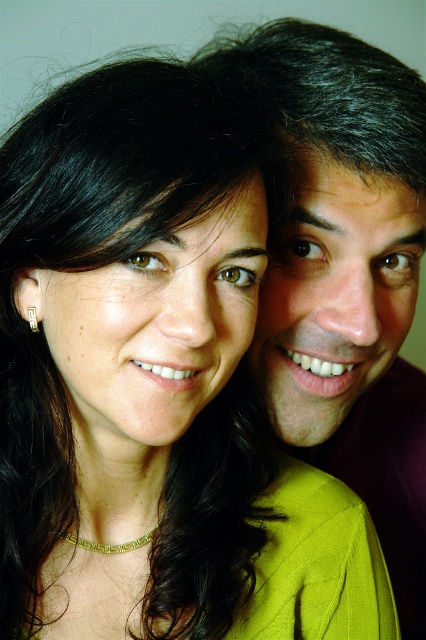
You are a photographer trying to capture a closeup of the gold textured necklace at lower center and the gold textured square at left. Which object should you focus on first if you want to ensure both are in focus without moving the camera?

The gold textured square at left is closer to the camera than the gold textured necklace at lower center, so focusing on the gold textured square at left first will help keep both in focus.

You are standing in front of the portrait and want to place a small sticker exactly at the point marked as point [109,545]. Which object in the scene will the sticker land on?

The sticker will land on the gold textured necklace at lower center because the point [109,545] is located on that object.

You are a photographer adjusting the focus on your camera. You want to capture both the gold textured necklace at lower center and the gold textured square at left in sharp focus. The camera can only focus on objects within a 7 inch range. Can both objects be in focus at the same time?

The distance between the gold textured necklace at lower center and the gold textured square at left is 8.09 inches, which exceeds the camera focus range of 7 inches. Therefore, both objects cannot be in focus simultaneously.